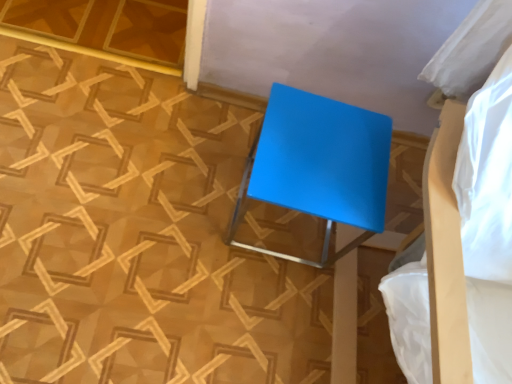
Where is `free location to the right of blue glossy stool at center`? This screenshot has width=512, height=384. free location to the right of blue glossy stool at center is located at coordinates (365, 258).